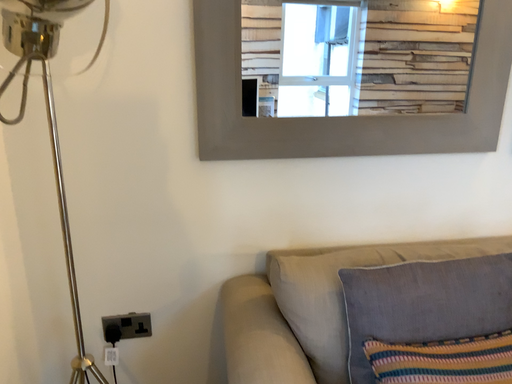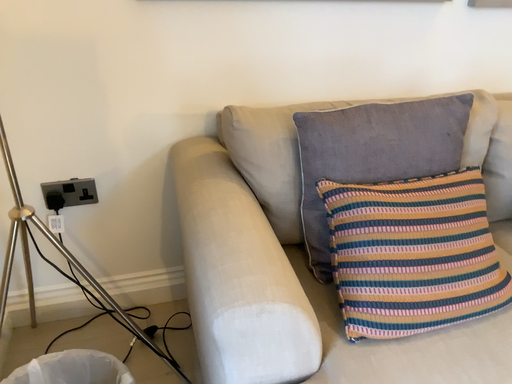
Question: Which way did the camera rotate in the video?

Choices:
 (A) rotated right
 (B) rotated left

Answer: (A)